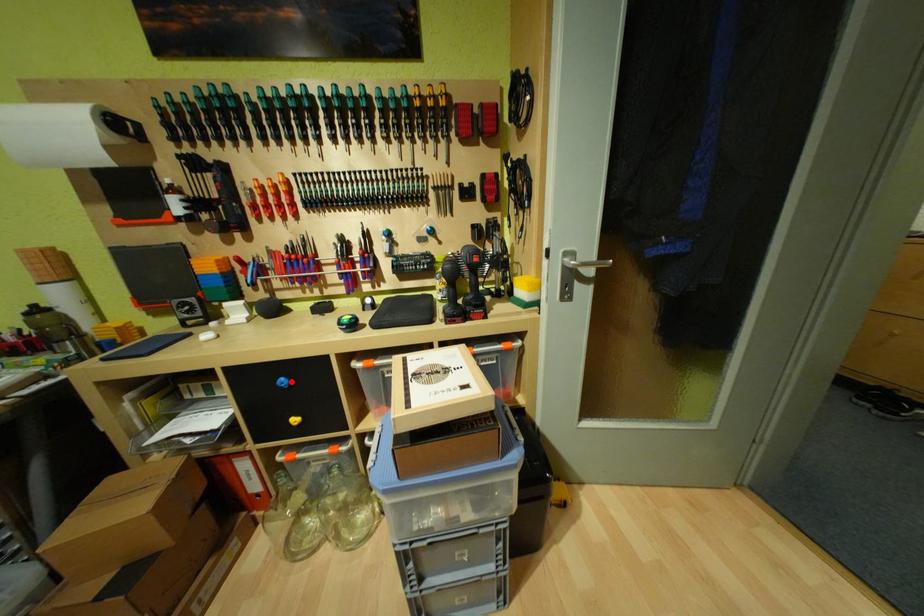
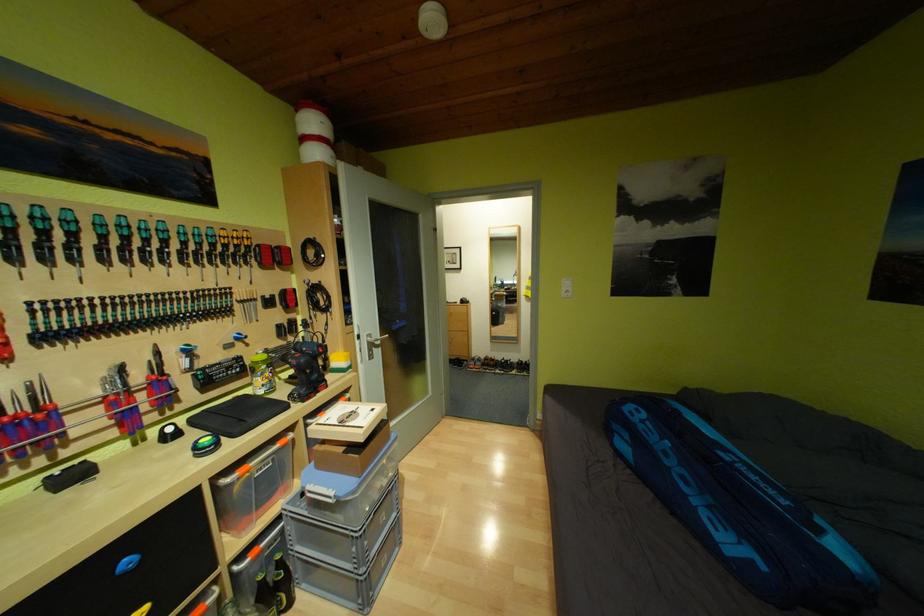
Question: I am providing you with two images of the same scene from different viewpoints. A red point is shown in image1. For the corresponding object point in image2, is it positioned nearer or farther from the camera?

Choices:
 (A) Nearer
 (B) Farther

Answer: (A)